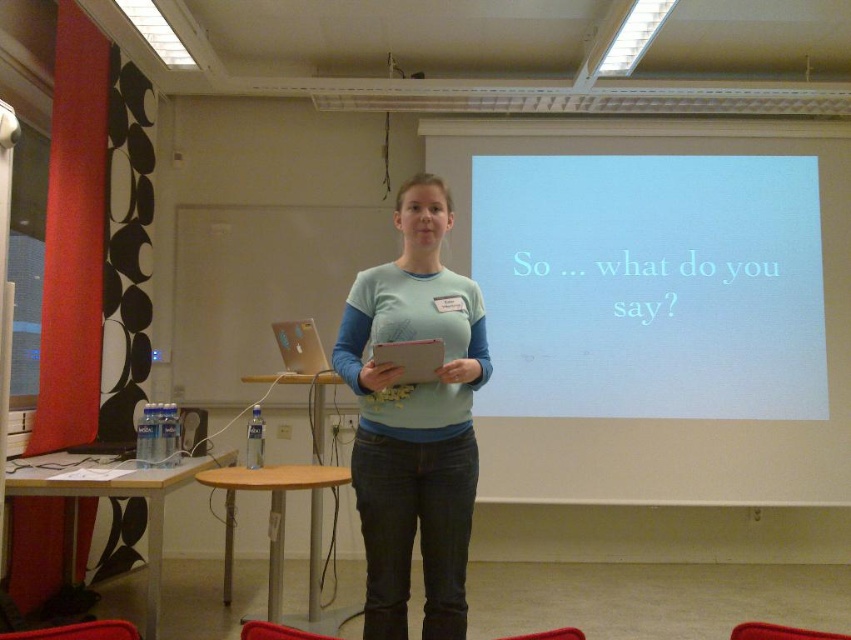
You are standing in the classroom and want to reach the point marked at coordinates (610, 154). If your walking speed is 1.2 meters per second, how many seconds will it take you to reach that point?

The point marked at coordinates (610, 154) is 4.38 meters away from you. At a speed of 1.2 meters per second, it will take approximately 3.65 seconds to reach there.

You are a student sitting at the back of the classroom. You need to hand in a paper to the person in the light blue cotton shirt at center. The white matte projection screen at upper center is blocking your view. Which direction should you move to avoid the screen?

You should move to the left to avoid the white matte projection screen at upper center, as it is to the right of the light blue cotton shirt at center.

You are an interior designer assessing the classroom layout. The white matte projection screen at upper center and the light blue cotton shirt at center are both visible. Which object occupies a greater area in the image?

Result: The white matte projection screen at upper center is larger in size than the light blue cotton shirt at center, so it occupies a greater area in the image.